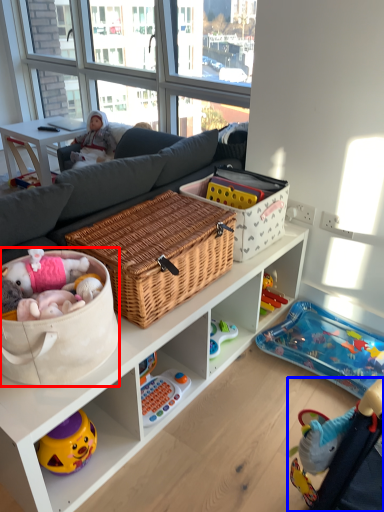
Question: Which object appears farthest to the camera in this image, storage box (highlighted by a red box) or baby carriage (highlighted by a blue box)?

Choices:
 (A) storage box
 (B) baby carriage

Answer: (A)